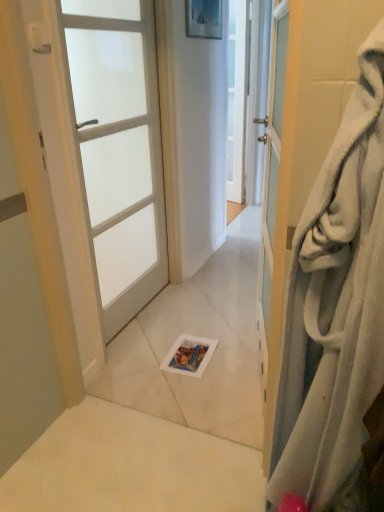
Question: Does point (99, 86) appear closer or farther from the camera than point (278, 222)?

Choices:
 (A) closer
 (B) farther

Answer: (B)

Question: Considering their positions, is white frosted glass door at left, which appears as the 2th door when viewed from the right, located in front of or behind white fabric door at right, which appears as the second door when viewed from the left?

Choices:
 (A) behind
 (B) front

Answer: (A)

Question: From a real-world perspective, is white frosted glass door at left, which appears as the 2th door when viewed from the right, above or below white fabric door at right, the 1th door in the right-to-left sequence?

Choices:
 (A) above
 (B) below

Answer: (A)

Question: Is point (284, 151) closer or farther from the camera than point (109, 30)?

Choices:
 (A) closer
 (B) farther

Answer: (A)

Question: From the image's perspective, is white fabric door at right, the 1th door in the right-to-left sequence, located above or below white frosted glass door at left, which is the first door in left-to-right order?

Choices:
 (A) above
 (B) below

Answer: (B)

Question: In the image, is white fabric door at right, the 1th door in the right-to-left sequence, on the left side or the right side of white frosted glass door at left, which is the first door in left-to-right order?

Choices:
 (A) left
 (B) right

Answer: (B)

Question: From a real-world perspective, is white fabric door at right, the 1th door in the right-to-left sequence, positioned above or below white frosted glass door at left, acting as the 2th door starting from the front?

Choices:
 (A) above
 (B) below

Answer: (B)